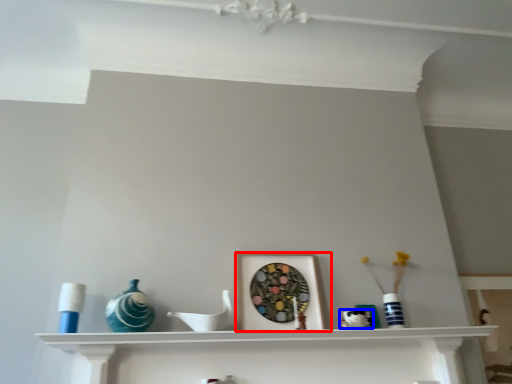
Question: Which point is further to the camera, picture frame (highlighted by a red box) or art (highlighted by a blue box)?

Choices:
 (A) picture frame
 (B) art

Answer: (A)